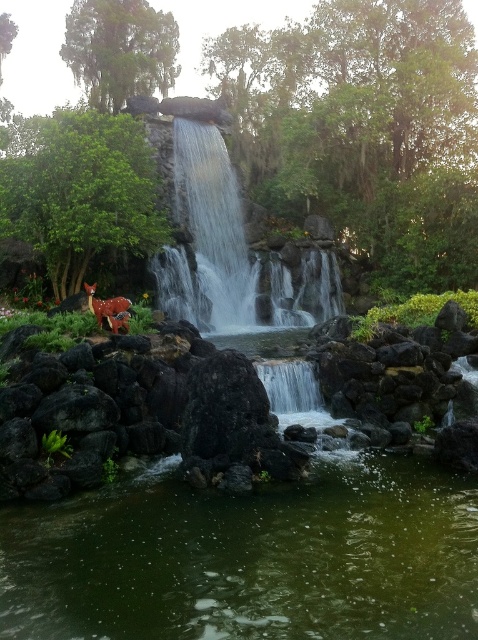
Who is more forward, (x=199, y=168) or (x=90, y=291)?

Point (x=90, y=291) is more forward.

In the scene shown: Does translucent glass waterfall at center appear on the left side of spotted deer at lower left?

Incorrect, translucent glass waterfall at center is not on the left side of spotted deer at lower left.

Between point (225, 202) and point (97, 307), which one is positioned behind?

Point (225, 202)

Find the location of `translucent glass waterfall at center`. translucent glass waterfall at center is located at coordinates (214, 224).

Between green liquid water at center bottom and translucent glass waterfall at center, which one is positioned lower?

green liquid water at center bottom is lower down.

I want to click on green liquid water at center bottom, so click(x=249, y=557).

Is green liquid water at center bottom above spotted deer at lower left?

Incorrect, green liquid water at center bottom is not positioned above spotted deer at lower left.

Is the position of green liquid water at center bottom more distant than that of spotted deer at lower left?

That is False.

Is point (312, 492) less distant than point (97, 310)?

Yes, it is.

Where is `green liquid water at center bottom`? green liquid water at center bottom is located at coordinates (249, 557).